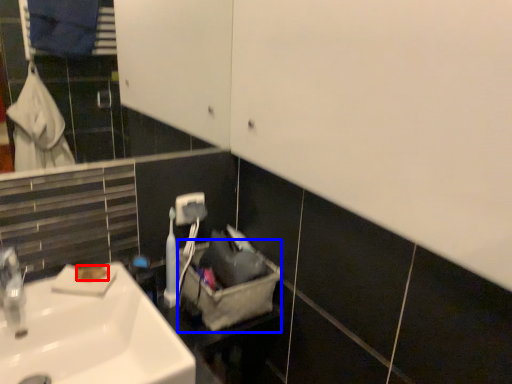
Question: Among these objects, which one is nearest to the camera, soap (highlighted by a red box) or laundry basket (highlighted by a blue box)?

Choices:
 (A) soap
 (B) laundry basket

Answer: (A)